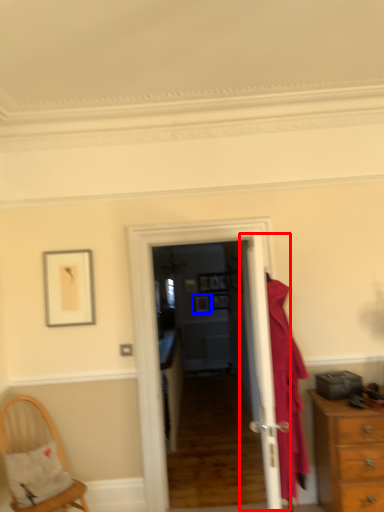
Question: Which of the following is the farthest to the observer, door (highlighted by a red box) or picture frame (highlighted by a blue box)?

Choices:
 (A) door
 (B) picture frame

Answer: (B)